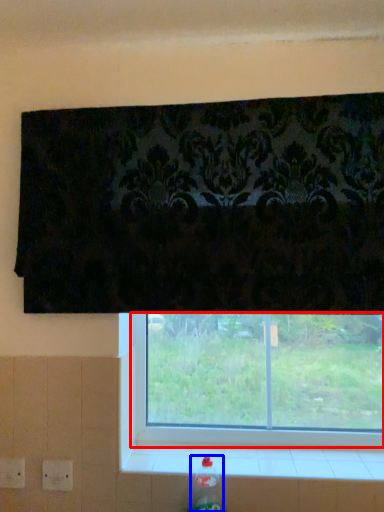
Question: Among these objects, which one is nearest to the camera, window (highlighted by a red box) or bottle (highlighted by a blue box)?

Choices:
 (A) window
 (B) bottle

Answer: (B)